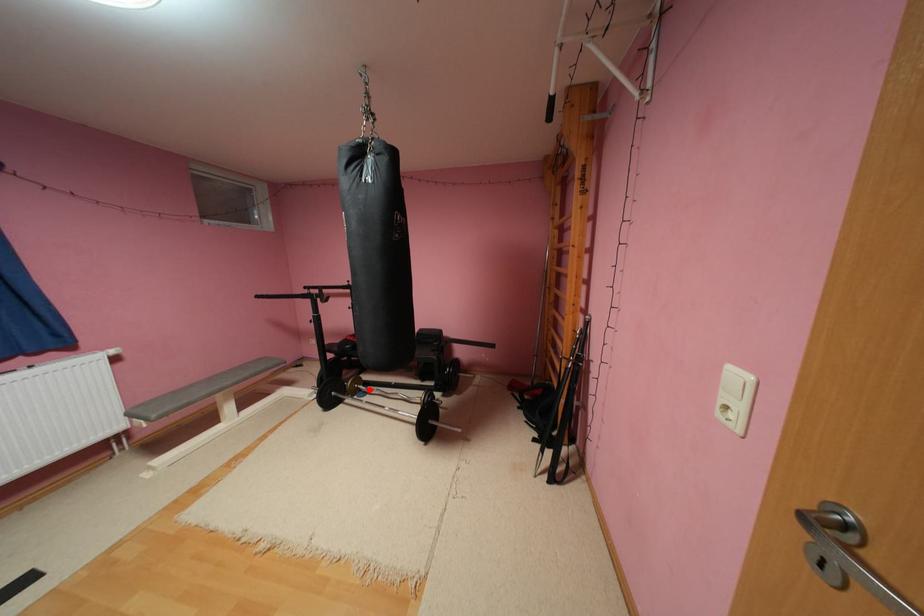
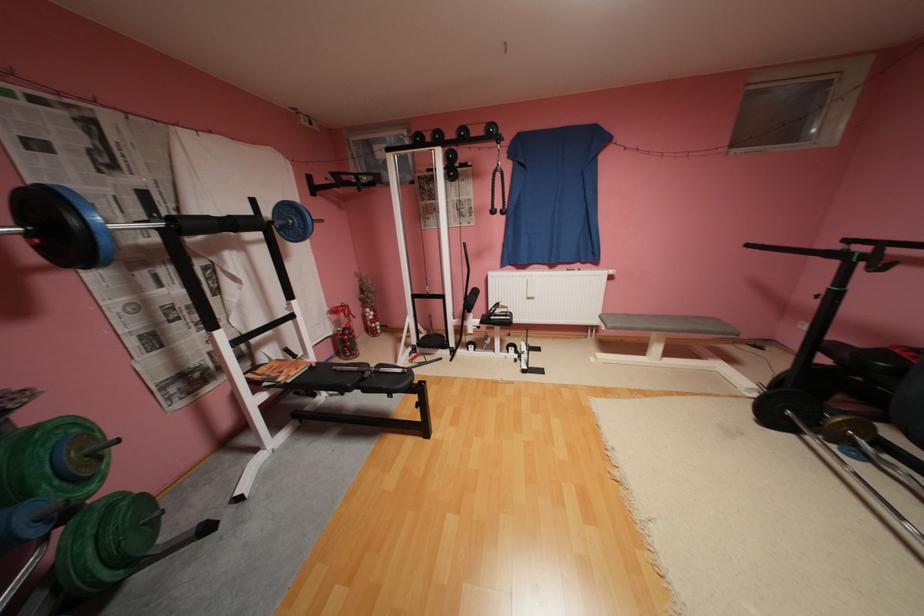
Where in the second image is the point corresponding to the highlighted location from the first image?

(867, 445)